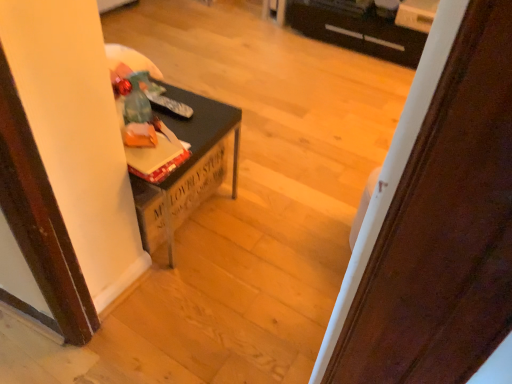
Where is `vacant area that lies to the right of matte black table at left`? This screenshot has height=384, width=512. vacant area that lies to the right of matte black table at left is located at coordinates (273, 215).